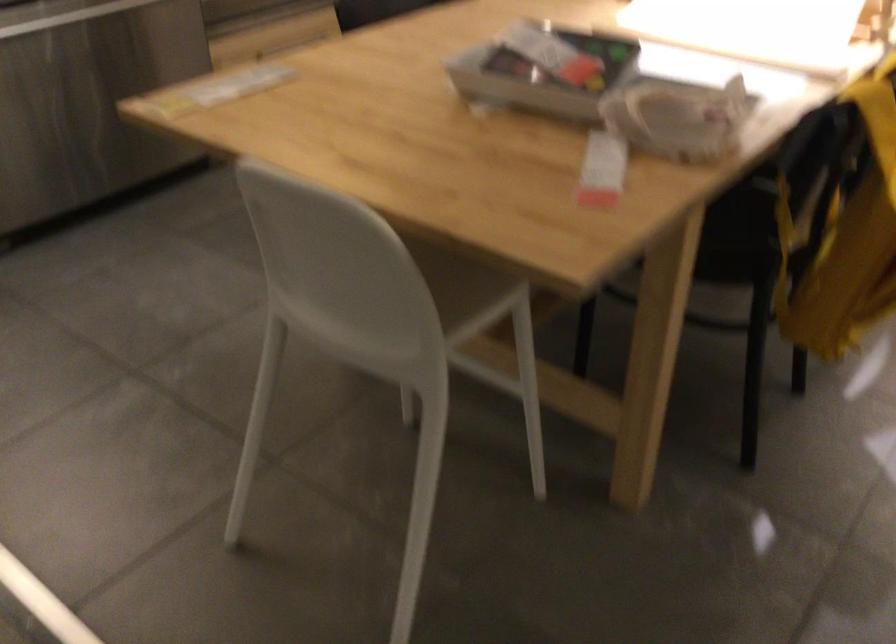
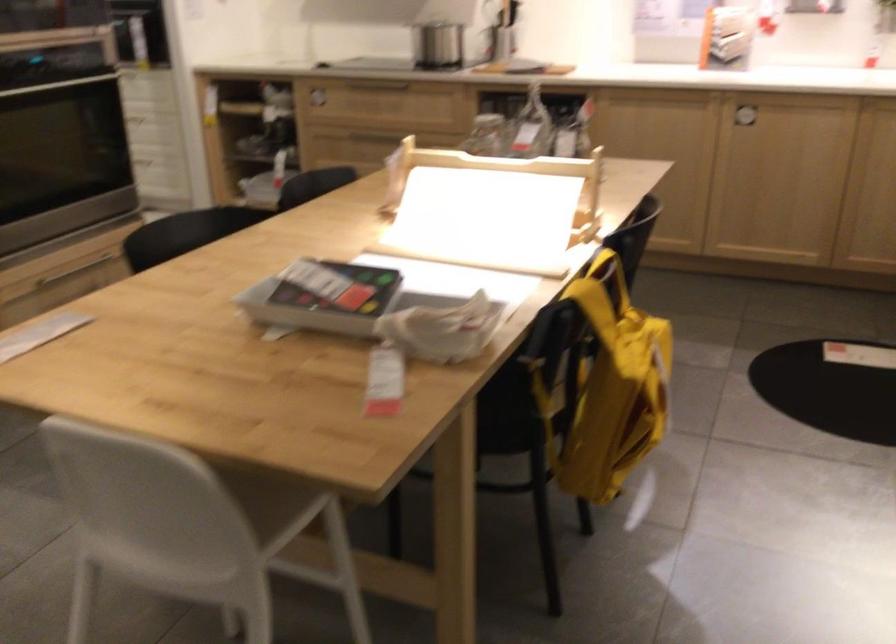
In the second image, find the point that corresponds to the point at 349,315 in the first image.

(171, 543)